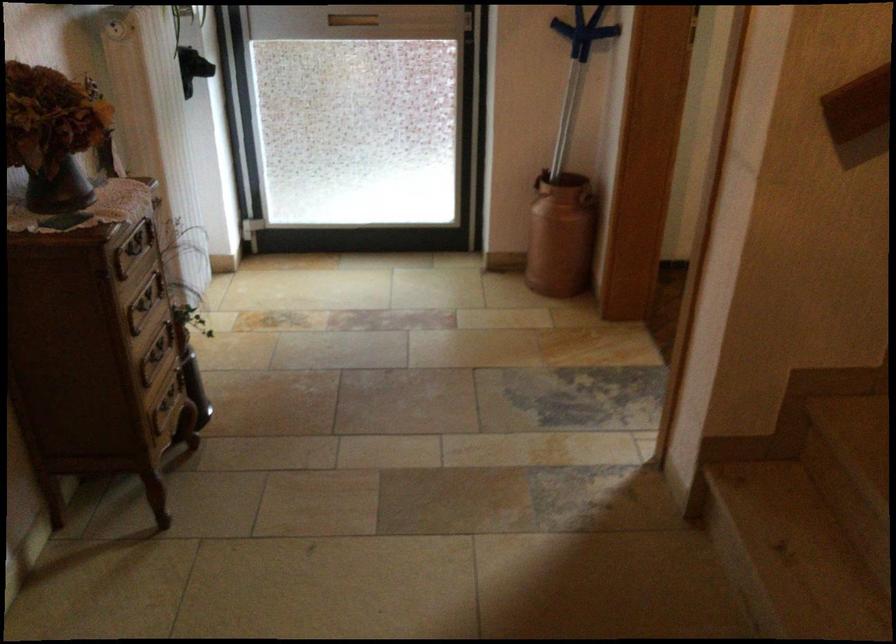
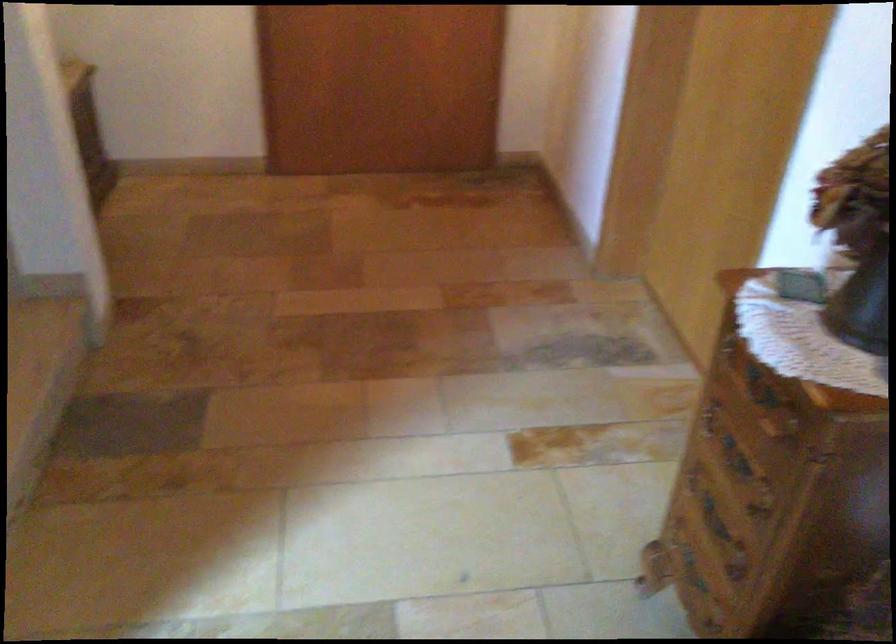
In the second image, find the point that corresponds to [116,290] in the first image.

(760, 386)